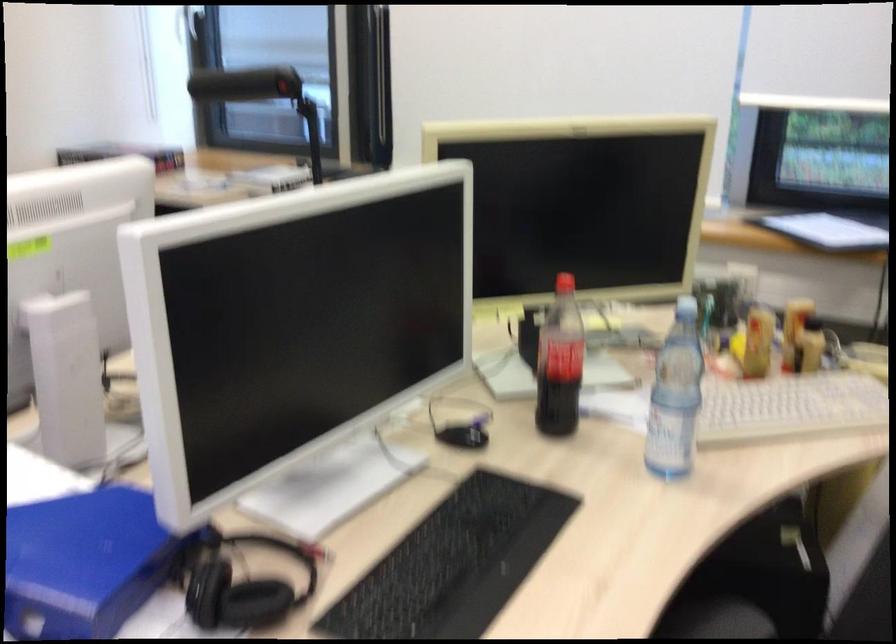
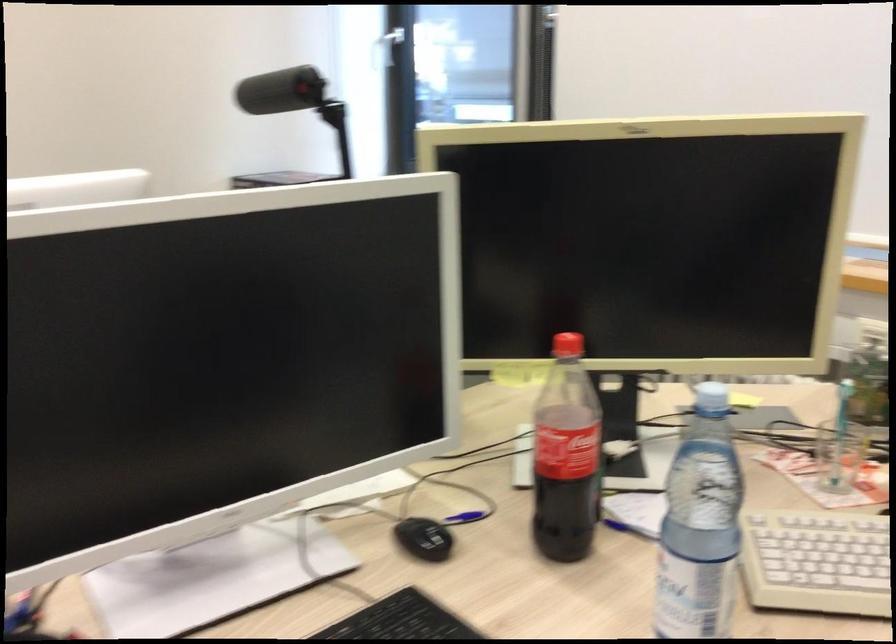
Question: The camera is either moving clockwise (left) or counter-clockwise (right) around the object. The first image is from the beginning of the video and the second image is from the end. Is the camera moving left or right when shooting the video?

Choices:
 (A) Left
 (B) Right

Answer: (B)